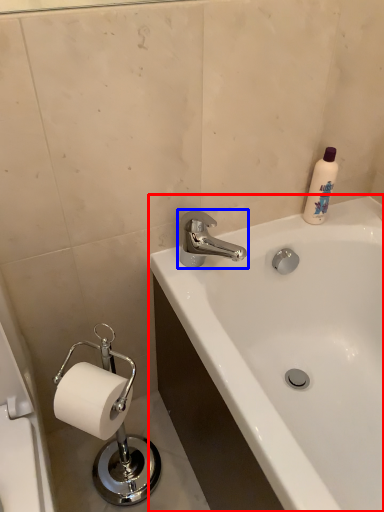
Question: Which object is further to the camera taking this photo, bathtub (highlighted by a red box) or tap (highlighted by a blue box)?

Choices:
 (A) bathtub
 (B) tap

Answer: (B)